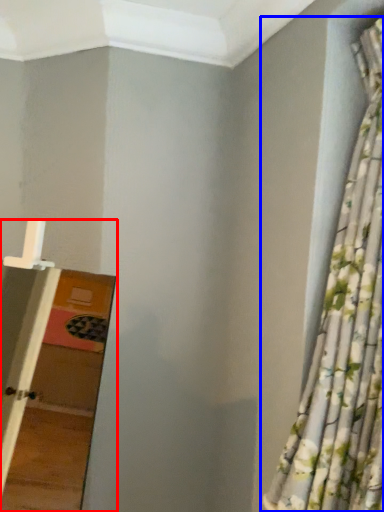
Question: Which object appears farthest to the camera in this image, ladder (highlighted by a red box) or curtain (highlighted by a blue box)?

Choices:
 (A) ladder
 (B) curtain

Answer: (B)